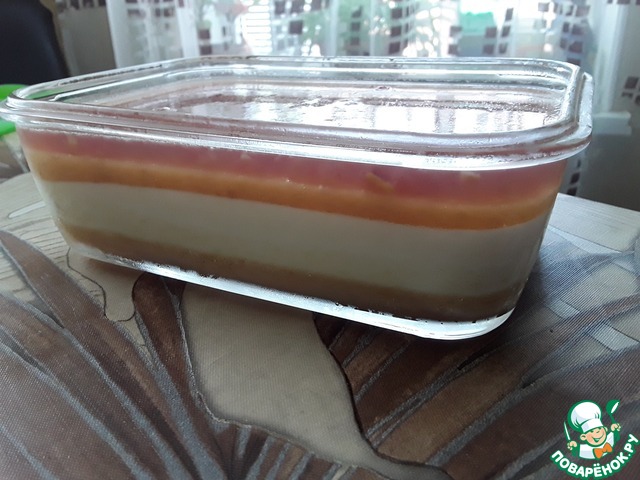
You are a GUI agent. You are given a task and a screenshot of the screen. Output one action in this format:
    pyautogui.click(x=<x>, y=<y>)
    Task: Click on the windows
    Image resolution: width=640 pixels, height=480 pixels.
    Given the screenshot: What is the action you would take?
    pyautogui.click(x=499, y=5)